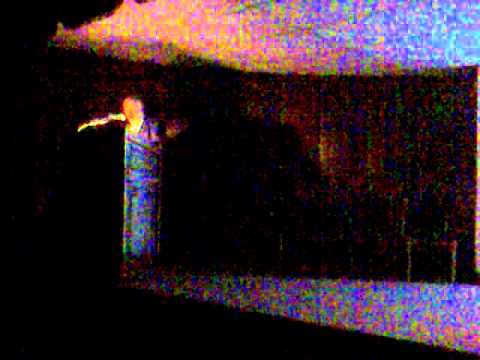
You are a GUI agent. You are given a task and a screenshot of the screen. Output one action in this format:
    pyautogui.click(x=<x>, y=<y>)
    Task: Click on the colored lights
    Image resolution: width=480 pixels, height=360 pixels.
    Given the screenshot: What is the action you would take?
    pyautogui.click(x=69, y=83), pyautogui.click(x=167, y=39), pyautogui.click(x=313, y=26), pyautogui.click(x=438, y=44), pyautogui.click(x=300, y=63), pyautogui.click(x=288, y=8), pyautogui.click(x=147, y=47), pyautogui.click(x=208, y=43), pyautogui.click(x=165, y=23)